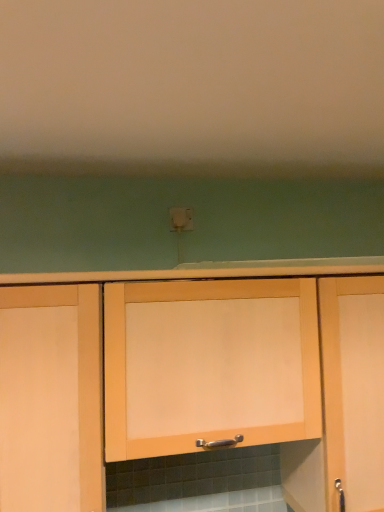
Question: Can you confirm if light wood cabinet at center, the 1th cabinetry when ordered from right to left, is shorter than light wood cabinet at center, the 2th cabinetry from the left?

Choices:
 (A) no
 (B) yes

Answer: (A)

Question: Is the depth of light wood cabinet at center, the 1th cabinetry when ordered from right to left, less than that of light wood cabinet at center, the 2th cabinetry from the left?

Choices:
 (A) yes
 (B) no

Answer: (B)

Question: Is light wood cabinet at center, acting as the third cabinetry starting from the left, next to light wood cabinet at center, the 2th cabinetry from the left, and touching it?

Choices:
 (A) yes
 (B) no

Answer: (B)

Question: Considering the relative sizes of light wood cabinet at center, the 1th cabinetry when ordered from right to left, and light wood cabinet at center, acting as the 2th cabinetry starting from the right, in the image provided, is light wood cabinet at center, the 1th cabinetry when ordered from right to left, taller than light wood cabinet at center, acting as the 2th cabinetry starting from the right,?

Choices:
 (A) no
 (B) yes

Answer: (B)

Question: Is light wood cabinet at center, acting as the third cabinetry starting from the left, behind light wood cabinet at center, acting as the 2th cabinetry starting from the right?

Choices:
 (A) yes
 (B) no

Answer: (A)

Question: Is light wood cabinet at center, acting as the third cabinetry starting from the left, wider or thinner than matte wood cabinet at left, the first cabinetry when ordered from left to right?

Choices:
 (A) wide
 (B) thin

Answer: (A)

Question: Is light wood cabinet at center, acting as the third cabinetry starting from the left, taller or shorter than matte wood cabinet at left, the first cabinetry when ordered from left to right?

Choices:
 (A) tall
 (B) short

Answer: (A)

Question: In the image, is light wood cabinet at center, the 1th cabinetry when ordered from right to left, positioned in front of or behind matte wood cabinet at left, the 3th cabinetry in the right-to-left sequence?

Choices:
 (A) front
 (B) behind

Answer: (B)

Question: From the image's perspective, is light wood cabinet at center, the 1th cabinetry when ordered from right to left, above or below matte wood cabinet at left, the first cabinetry when ordered from left to right?

Choices:
 (A) above
 (B) below

Answer: (B)

Question: From their relative heights in the image, would you say light wood cabinet at center, acting as the 2th cabinetry starting from the right, is taller or shorter than light wood cabinet at center, the 1th cabinetry when ordered from right to left?

Choices:
 (A) short
 (B) tall

Answer: (A)

Question: Is light wood cabinet at center, acting as the 2th cabinetry starting from the right, in front of or behind light wood cabinet at center, the 1th cabinetry when ordered from right to left, in the image?

Choices:
 (A) front
 (B) behind

Answer: (A)

Question: Is point (119, 340) closer or farther from the camera than point (347, 412)?

Choices:
 (A) closer
 (B) farther

Answer: (A)

Question: Would you say light wood cabinet at center, acting as the 2th cabinetry starting from the right, is inside or outside light wood cabinet at center, acting as the third cabinetry starting from the left?

Choices:
 (A) outside
 (B) inside

Answer: (A)

Question: Is point (72, 349) positioned closer to the camera than point (336, 302)?

Choices:
 (A) farther
 (B) closer

Answer: (B)

Question: Considering the positions of matte wood cabinet at left, the first cabinetry when ordered from left to right, and light wood cabinet at center, the 1th cabinetry when ordered from right to left, in the image, is matte wood cabinet at left, the first cabinetry when ordered from left to right, wider or thinner than light wood cabinet at center, the 1th cabinetry when ordered from right to left,?

Choices:
 (A) thin
 (B) wide

Answer: (A)